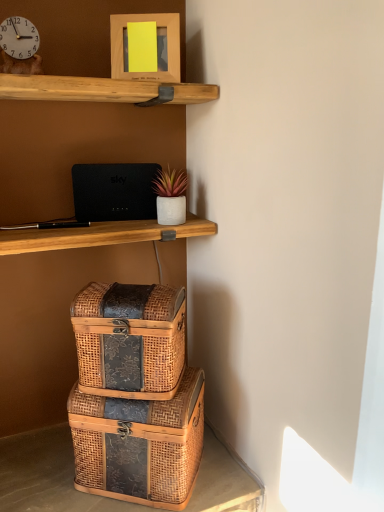
Locate an element on the screen. This screenshot has height=512, width=384. empty space that is ontop of woven wood trunk at lower center is located at coordinates (83, 485).